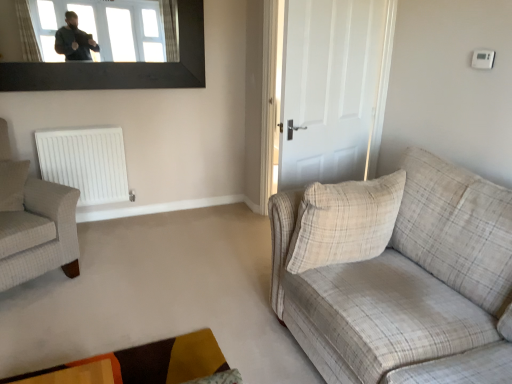
You are a GUI agent. You are given a task and a screenshot of the screen. Output one action in this format:
    pyautogui.click(x=<x>, y=<y>)
    Task: Click on the vacant space underneath transparent glass window at upper center (from a real-world perspective)
    The width and height of the screenshot is (512, 384).
    Given the screenshot: What is the action you would take?
    pyautogui.click(x=165, y=207)